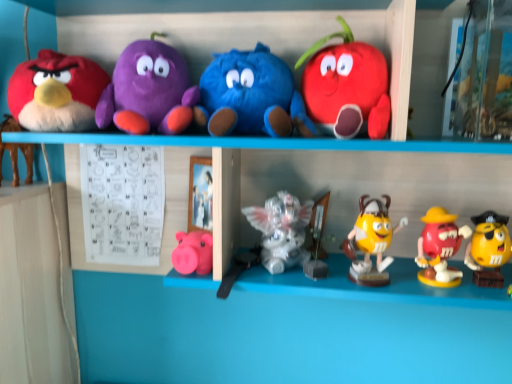
What is the approximate width of matte plush bird at left, the second toy from the left?

It is 6.96 inches.

What do you see at coordinates (193, 253) in the screenshot? The height and width of the screenshot is (384, 512). I see `matte pink piggy bank at lower center, which is the 7th toy in right-to-left order` at bounding box center [193, 253].

This screenshot has height=384, width=512. What do you see at coordinates (281, 231) in the screenshot? I see `translucent plastic angel at center, which is counted as the sixth toy, starting from the left` at bounding box center [281, 231].

What do you see at coordinates (488, 248) in the screenshot? I see `yellow matte m&m's character at lower right, the first toy positioned from the right` at bounding box center [488, 248].

Identify the location of brown plush toy at left, which ranks as the 10th toy in right-to-left order. This screenshot has height=384, width=512. (16, 151).

Find the location of a particular element. purple plush toy at upper left, the third toy viewed from the left is located at coordinates (148, 91).

Is rubberized red m&m figure at lower right, which is the ninth toy in left-to-right order, far away from yellow glossy m&m figure at center, acting as the third toy starting from the right?

They are positioned close to each other.

Can you tell me how much rubberized red m&m figure at lower right, which is the ninth toy in left-to-right order, and yellow glossy m&m figure at center, acting as the third toy starting from the right, differ in facing direction?

The angle between the facing direction of rubberized red m&m figure at lower right, which is the ninth toy in left-to-right order, and the facing direction of yellow glossy m&m figure at center, acting as the third toy starting from the right, is 0.000181 degrees.

Is rubberized red m&m figure at lower right, which is the ninth toy in left-to-right order, not within yellow glossy m&m figure at center, acting as the third toy starting from the right?

Absolutely, rubberized red m&m figure at lower right, which is the ninth toy in left-to-right order, is external to yellow glossy m&m figure at center, acting as the third toy starting from the right.

How much distance is there between rubberized red m&m figure at lower right, which is the ninth toy in left-to-right order, and yellow glossy m&m figure at center, arranged as the 8th toy when viewed from the left?

rubberized red m&m figure at lower right, which is the ninth toy in left-to-right order, is 9.98 centimeters away from yellow glossy m&m figure at center, arranged as the 8th toy when viewed from the left.

Is blue plush toy at center, positioned as the 5th toy in left-to-right order, inside or outside of yellow glossy m&m figure at center, arranged as the 8th toy when viewed from the left?

blue plush toy at center, positioned as the 5th toy in left-to-right order, is not inside yellow glossy m&m figure at center, arranged as the 8th toy when viewed from the left, it's outside.

Considering the relative sizes of blue plush toy at center, positioned as the 5th toy in left-to-right order, and yellow glossy m&m figure at center, acting as the third toy starting from the right, in the image provided, is blue plush toy at center, positioned as the 5th toy in left-to-right order, bigger than yellow glossy m&m figure at center, acting as the third toy starting from the right,?

Yes, blue plush toy at center, positioned as the 5th toy in left-to-right order, is bigger than yellow glossy m&m figure at center, acting as the third toy starting from the right.

Is blue plush toy at center, the 6th toy viewed from the right, directly adjacent to yellow glossy m&m figure at center, arranged as the 8th toy when viewed from the left?

No, blue plush toy at center, the 6th toy viewed from the right, is not next to yellow glossy m&m figure at center, arranged as the 8th toy when viewed from the left.

Looking at this image, how much distance is there between blue plush toy at center, the 6th toy viewed from the right, and yellow glossy m&m figure at center, acting as the third toy starting from the right?

blue plush toy at center, the 6th toy viewed from the right, and yellow glossy m&m figure at center, acting as the third toy starting from the right, are 10.84 inches apart.

Which of these two, matte plush toy at upper right, the 4th toy in the right-to-left sequence, or blue plush toy at center, the 6th toy viewed from the right, is smaller?

Result: matte plush toy at upper right, the 4th toy in the right-to-left sequence.

Considering the relative positions of matte plush toy at upper right, marked as the 7th toy in a left-to-right arrangement, and blue plush toy at center, the 6th toy viewed from the right, in the image provided, is matte plush toy at upper right, marked as the 7th toy in a left-to-right arrangement, to the left or to the right of blue plush toy at center, the 6th toy viewed from the right,?

matte plush toy at upper right, marked as the 7th toy in a left-to-right arrangement, is to the right of blue plush toy at center, the 6th toy viewed from the right.

From the image's perspective, is matte plush toy at upper right, marked as the 7th toy in a left-to-right arrangement, beneath blue plush toy at center, positioned as the 5th toy in left-to-right order?

Actually, matte plush toy at upper right, marked as the 7th toy in a left-to-right arrangement, appears above blue plush toy at center, positioned as the 5th toy in left-to-right order, in the image.

What's the angular difference between matte plush toy at upper right, marked as the 7th toy in a left-to-right arrangement, and blue plush toy at center, positioned as the 5th toy in left-to-right order,'s facing directions?

They differ by 0.000565 degrees in their facing directions.

Would you say yellow glossy m&m figure at center, acting as the third toy starting from the right, is to the left or to the right of yellow matte m&m's character at lower right, the first toy positioned from the right, in the picture?

Based on their positions, yellow glossy m&m figure at center, acting as the third toy starting from the right, is located to the left of yellow matte m&m's character at lower right, the first toy positioned from the right.

Can you tell me how much yellow glossy m&m figure at center, arranged as the 8th toy when viewed from the left, and yellow matte m&m's character at lower right, the first toy positioned from the right, differ in facing direction?

yellow glossy m&m figure at center, arranged as the 8th toy when viewed from the left, and yellow matte m&m's character at lower right, the first toy positioned from the right, are facing 0.000704 degrees away from each other.

From the picture: From a real-world perspective, is yellow glossy m&m figure at center, arranged as the 8th toy when viewed from the left, beneath yellow matte m&m's character at lower right, which appears as the 10th toy when viewed from the left?

No.

Does yellow glossy m&m figure at center, arranged as the 8th toy when viewed from the left, contain yellow matte m&m's character at lower right, the first toy positioned from the right?

No, yellow matte m&m's character at lower right, the first toy positioned from the right, is located outside of yellow glossy m&m figure at center, arranged as the 8th toy when viewed from the left.

From the image's perspective, starting from the matte plush bird at left, the second toy from the left, which toy is the 6th one below? Please provide its 2D coordinates.

[(488, 248)]

From the picture: Which is nearer, (x=490, y=256) or (x=77, y=100)?

Point (x=490, y=256) appears to be closer to the viewer than point (x=77, y=100).

Is the surface of yellow matte m&m's character at lower right, which appears as the 10th toy when viewed from the left, in direct contact with matte plush bird at left, the 9th toy in the right-to-left sequence?

No, yellow matte m&m's character at lower right, which appears as the 10th toy when viewed from the left, is not beside matte plush bird at left, the 9th toy in the right-to-left sequence.

Looking at their sizes, would you say yellow matte m&m's character at lower right, the first toy positioned from the right, is wider or thinner than matte plush bird at left, the 9th toy in the right-to-left sequence?

In the image, yellow matte m&m's character at lower right, the first toy positioned from the right, appears to be more narrow than matte plush bird at left, the 9th toy in the right-to-left sequence.

Is blue plush toy at center, positioned as the 5th toy in left-to-right order, closer to the viewer compared to matte plush toy at upper right, the 4th toy in the right-to-left sequence?

No, it is not.

Is blue plush toy at center, positioned as the 5th toy in left-to-right order, positioned beyond the bounds of matte plush toy at upper right, the 4th toy in the right-to-left sequence?

Yes, blue plush toy at center, positioned as the 5th toy in left-to-right order, is not within matte plush toy at upper right, the 4th toy in the right-to-left sequence.

Would you consider blue plush toy at center, positioned as the 5th toy in left-to-right order, to be distant from matte plush toy at upper right, marked as the 7th toy in a left-to-right arrangement?

No, blue plush toy at center, positioned as the 5th toy in left-to-right order, is not far from matte plush toy at upper right, marked as the 7th toy in a left-to-right arrangement.

From a real-world perspective, between blue plush toy at center, positioned as the 5th toy in left-to-right order, and matte plush toy at upper right, the 4th toy in the right-to-left sequence, who is vertically lower?

From a 3D spatial view, blue plush toy at center, positioned as the 5th toy in left-to-right order, is below.

You are a GUI agent. You are given a task and a screenshot of the screen. Output one action in this format:
    pyautogui.click(x=<x>, y=<y>)
    Task: Click on the 1st toy located above the matte pink piggy bank at lower center, which appears as the fourth toy when viewed from the left (from a real-world perspective)
    This screenshot has height=384, width=512.
    Given the screenshot: What is the action you would take?
    pyautogui.click(x=488, y=248)

Considering the positions of objects yellow matte m&m's character at lower right, the first toy positioned from the right, and matte pink piggy bank at lower center, which is the 7th toy in right-to-left order, in the image provided, who is in front, yellow matte m&m's character at lower right, the first toy positioned from the right, or matte pink piggy bank at lower center, which is the 7th toy in right-to-left order,?

yellow matte m&m's character at lower right, the first toy positioned from the right, is in front.

Is yellow matte m&m's character at lower right, the first toy positioned from the right, facing away from matte pink piggy bank at lower center, which is the 7th toy in right-to-left order?

yellow matte m&m's character at lower right, the first toy positioned from the right, is not turned away from matte pink piggy bank at lower center, which is the 7th toy in right-to-left order.

I want to click on the 2nd toy below the yellow glossy m&m figure at center, arranged as the 8th toy when viewed from the left (from a real-world perspective), so click(440, 248).

From the yellow glossy m&m figure at center, arranged as the 8th toy when viewed from the left, count the 3rd toy to the left and point to it. Please provide its 2D coordinates.

[(251, 96)]

Looking at the image, which one is located further to matte pink piggy bank at lower center, which appears as the fourth toy when viewed from the left, matte plush toy at upper right, the 4th toy in the right-to-left sequence, or yellow glossy m&m figure at center, acting as the third toy starting from the right?

Among the two, matte plush toy at upper right, the 4th toy in the right-to-left sequence, is located further to matte pink piggy bank at lower center, which appears as the fourth toy when viewed from the left.

Based on their spatial positions, is matte pink piggy bank at lower center, which is the 7th toy in right-to-left order, or yellow matte m&m's character at lower right, the first toy positioned from the right, further from matte plush toy at upper right, marked as the 7th toy in a left-to-right arrangement?

matte pink piggy bank at lower center, which is the 7th toy in right-to-left order, is positioned further to the anchor matte plush toy at upper right, marked as the 7th toy in a left-to-right arrangement.

From the image, which object appears to be nearer to brown plush toy at left, which ranks as the 10th toy in right-to-left order, matte plush toy at upper right, marked as the 7th toy in a left-to-right arrangement, or translucent plastic angel at center, arranged as the 5th toy when viewed from the right?

translucent plastic angel at center, arranged as the 5th toy when viewed from the right, is closer to brown plush toy at left, which ranks as the 10th toy in right-to-left order.

Which object lies nearer to the anchor point matte pink piggy bank at lower center, which appears as the fourth toy when viewed from the left, matte plush bird at left, the 9th toy in the right-to-left sequence, or brown plush toy at left, the 1th toy from the left?

Among the two, matte plush bird at left, the 9th toy in the right-to-left sequence, is located nearer to matte pink piggy bank at lower center, which appears as the fourth toy when viewed from the left.

Estimate the real-world distances between objects in this image. Which object is further from yellow matte m&m's character at lower right, the first toy positioned from the right, brown plush toy at left, which ranks as the 10th toy in right-to-left order, or blue plush toy at center, positioned as the 5th toy in left-to-right order?

Based on the image, brown plush toy at left, which ranks as the 10th toy in right-to-left order, appears to be further to yellow matte m&m's character at lower right, the first toy positioned from the right.

When comparing their distances from brown plush toy at left, which ranks as the 10th toy in right-to-left order, does matte plush toy at upper right, marked as the 7th toy in a left-to-right arrangement, or yellow glossy m&m figure at center, acting as the third toy starting from the right, seem further?

yellow glossy m&m figure at center, acting as the third toy starting from the right, lies further to brown plush toy at left, which ranks as the 10th toy in right-to-left order, than the other object.

From the image, which object appears to be farther from matte pink piggy bank at lower center, which appears as the fourth toy when viewed from the left, purple plush toy at upper left, the third toy viewed from the left, or matte plush bird at left, the second toy from the left?

Based on the image, matte plush bird at left, the second toy from the left, appears to be further to matte pink piggy bank at lower center, which appears as the fourth toy when viewed from the left.

From the image, which object appears to be nearer to purple plush toy at upper left, the third toy viewed from the left, matte pink piggy bank at lower center, which is the 7th toy in right-to-left order, or rubberized red m&m figure at lower right, which is the ninth toy in left-to-right order?

matte pink piggy bank at lower center, which is the 7th toy in right-to-left order, is closer to purple plush toy at upper left, the third toy viewed from the left.

Find the location of `toy situated between brown plush toy at left, the 1th toy from the left, and purple plush toy at upper left, which appears as the eighth toy when viewed from the right, from left to right`. toy situated between brown plush toy at left, the 1th toy from the left, and purple plush toy at upper left, which appears as the eighth toy when viewed from the right, from left to right is located at coordinates (56, 92).

At what (x,y) coordinates should I click in order to perform the action: click on toy between yellow glossy m&m figure at center, acting as the third toy starting from the right, and yellow matte m&m's character at lower right, the first toy positioned from the right. Please return your answer as a coordinate pair (x, y). Looking at the image, I should click on (440, 248).